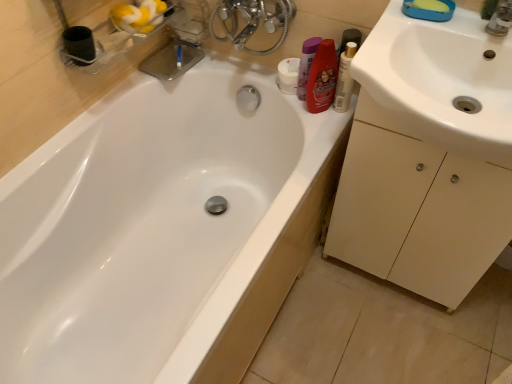
This screenshot has height=384, width=512. I want to click on space that is in front of shiny plastic shampoo bottle at upper center, which is counted as the 3th toiletry, starting from the right, so click(313, 118).